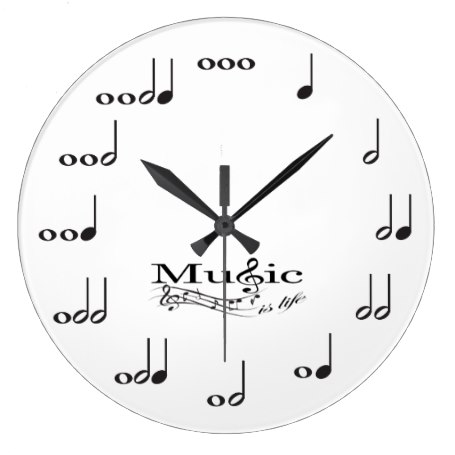
Locate an element on the screen. top of the clock is located at coordinates (223, 17).